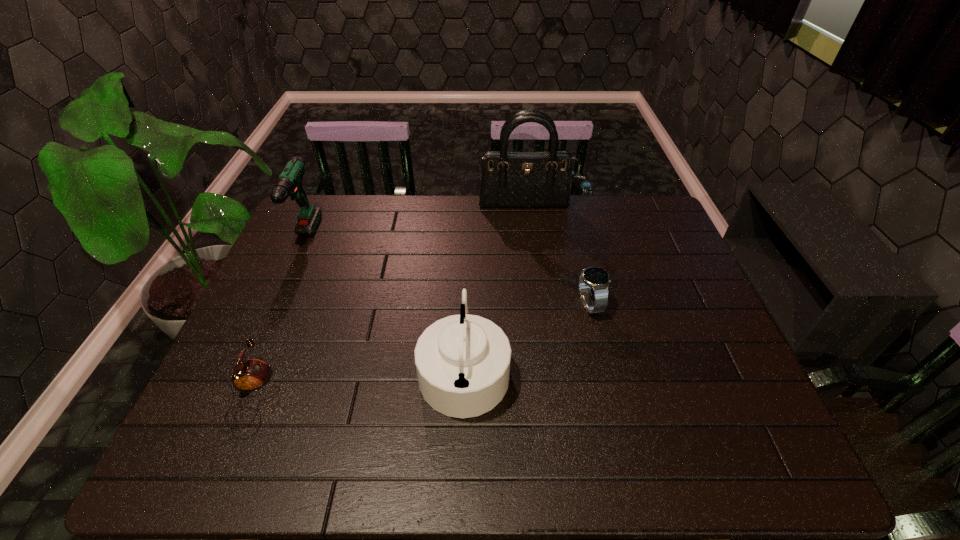
Identify the location of free region at the far edge. click(x=591, y=204).

In the image, there is a desktop. Where is `vacant space at the near edge`? This screenshot has height=540, width=960. vacant space at the near edge is located at coordinates (544, 471).

The width and height of the screenshot is (960, 540). Identify the location of free space at the left edge of the desktop. (280, 325).

You are a GUI agent. You are given a task and a screenshot of the screen. Output one action in this format:
    pyautogui.click(x=<x>, y=<y>)
    Task: Click on the vacant space at the right edge
    
    Given the screenshot: What is the action you would take?
    pyautogui.click(x=659, y=295)

The width and height of the screenshot is (960, 540). What are the coordinates of `vacant area at the near left corner of the desktop` in the screenshot? It's located at (230, 454).

The image size is (960, 540). I want to click on free space at the far right corner of the desktop, so click(619, 202).

The height and width of the screenshot is (540, 960). Identify the location of unoccupied position between the drill and the kettle. (384, 304).

The height and width of the screenshot is (540, 960). Find the location of `vacant point located between the telephone and the second farthest object`. vacant point located between the telephone and the second farthest object is located at coordinates (277, 318).

Image resolution: width=960 pixels, height=540 pixels. I want to click on vacant region between the second farthest object and the shortest object, so click(x=277, y=318).

You are a GUI agent. You are given a task and a screenshot of the screen. Output one action in this format:
    pyautogui.click(x=<x>, y=<y>)
    Task: Click on the unoccupied area between the third tallest object and the second shortest object
    The image size is (960, 540).
    Given the screenshot: What is the action you would take?
    pyautogui.click(x=527, y=336)